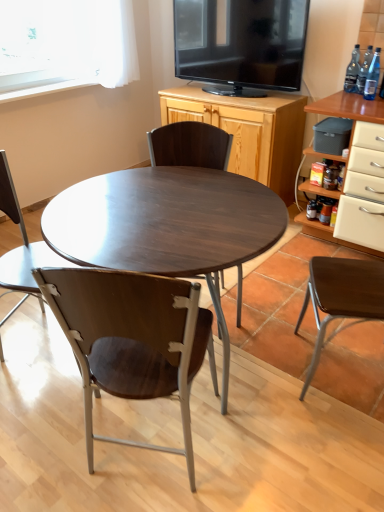
Question: Is clear glass bottle at upper right, the 1th bottle from the back, outside brown wood chair at right, arranged as the 1th chair when viewed from the right?

Choices:
 (A) no
 (B) yes

Answer: (B)

Question: Is clear glass bottle at upper right, marked as the 3th bottle in a front-to-back arrangement, oriented away from brown wood chair at right, acting as the fourth chair starting from the left?

Choices:
 (A) yes
 (B) no

Answer: (B)

Question: Could you tell me if clear glass bottle at upper right, marked as the 3th bottle in a front-to-back arrangement, is facing brown wood chair at right, acting as the fourth chair starting from the left?

Choices:
 (A) no
 (B) yes

Answer: (A)

Question: Does clear glass bottle at upper right, the 1th bottle from the back, have a smaller size compared to brown wood chair at right, arranged as the 1th chair when viewed from the right?

Choices:
 (A) no
 (B) yes

Answer: (B)

Question: From a real-world perspective, is clear glass bottle at upper right, the 1th bottle from the back, positioned over brown wood chair at right, arranged as the 1th chair when viewed from the right, based on gravity?

Choices:
 (A) yes
 (B) no

Answer: (A)

Question: Considering the positions of matte black tv at upper center and wooden cabinet at upper center in the image, is matte black tv at upper center bigger or smaller than wooden cabinet at upper center?

Choices:
 (A) small
 (B) big

Answer: (A)

Question: In terms of height, does matte black tv at upper center look taller or shorter compared to wooden cabinet at upper center?

Choices:
 (A) short
 (B) tall

Answer: (A)

Question: From a real-world perspective, is matte black tv at upper center physically located above or below wooden cabinet at upper center?

Choices:
 (A) below
 (B) above

Answer: (B)

Question: In the image, is matte black tv at upper center on the left side or the right side of wooden cabinet at upper center?

Choices:
 (A) right
 (B) left

Answer: (A)

Question: Relative to dark wood/finish coffee table at center, is brown wood chair at right, arranged as the 1th chair when viewed from the right, in front or behind?

Choices:
 (A) front
 (B) behind

Answer: (B)

Question: Based on their sizes in the image, would you say brown wood chair at right, acting as the fourth chair starting from the left, is bigger or smaller than dark wood/finish coffee table at center?

Choices:
 (A) big
 (B) small

Answer: (B)

Question: Is point (342, 302) closer or farther from the camera than point (251, 245)?

Choices:
 (A) closer
 (B) farther

Answer: (B)

Question: Looking at their shapes, would you say brown wood chair at right, acting as the fourth chair starting from the left, is wider or thinner than dark wood/finish coffee table at center?

Choices:
 (A) thin
 (B) wide

Answer: (A)

Question: Is brown wood chair at right, arranged as the 1th chair when viewed from the right, wider or thinner than transparent glass bottle at upper right, placed as the second bottle when sorted from back to front?

Choices:
 (A) thin
 (B) wide

Answer: (B)

Question: Relative to transparent glass bottle at upper right, arranged as the 2th bottle when viewed from the front, is brown wood chair at right, arranged as the 1th chair when viewed from the right, in front or behind?

Choices:
 (A) front
 (B) behind

Answer: (A)